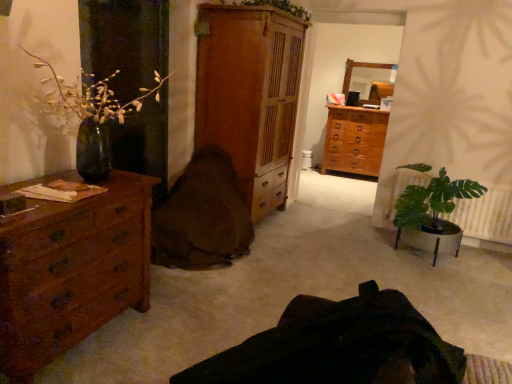
Describe the element at coordinates (354, 140) in the screenshot. Image resolution: width=512 pixels, height=384 pixels. I see `brown wooden chest of drawers at center, which appears as the 1th chest of drawers when viewed from the back` at that location.

Measure the distance between point (224, 91) and camera.

Point (224, 91) and camera are 11.75 feet apart.

Find the location of a particular element. green glossy vase at left, marked as the 1th houseplant in a left-to-right arrangement is located at coordinates [93, 96].

Image resolution: width=512 pixels, height=384 pixels. Describe the element at coordinates (72, 271) in the screenshot. I see `brown wood chest of drawers at left, the first chest of drawers when ordered from left to right` at that location.

The height and width of the screenshot is (384, 512). Describe the element at coordinates (202, 216) in the screenshot. I see `brown fabric swivel chair at center, placed as the first swivel chair when sorted from back to front` at that location.

The height and width of the screenshot is (384, 512). What do you see at coordinates (360, 67) in the screenshot?
I see `wooden frame mirror at upper center` at bounding box center [360, 67].

Locate an element on the screen. This screenshot has height=384, width=512. green leafy plant at lower right, placed as the second houseplant when sorted from front to back is located at coordinates (433, 213).

Which object is further away from the camera, green leafy plant at lower right, marked as the first houseplant in a back-to-front arrangement, or brown wood chest of drawers at left, the first chest of drawers when ordered from left to right?

green leafy plant at lower right, marked as the first houseplant in a back-to-front arrangement, is further away from the camera.

Considering the sizes of green leafy plant at lower right, which is counted as the 1th houseplant, starting from the right, and brown wood chest of drawers at left, the first chest of drawers when ordered from left to right, in the image, is green leafy plant at lower right, which is counted as the 1th houseplant, starting from the right, taller or shorter than brown wood chest of drawers at left, the first chest of drawers when ordered from left to right,?

green leafy plant at lower right, which is counted as the 1th houseplant, starting from the right, is shorter than brown wood chest of drawers at left, the first chest of drawers when ordered from left to right.

Is brown wood chest of drawers at left, the 3th chest of drawers in the back-to-front sequence, at the back of green leafy plant at lower right, placed as the second houseplant when sorted from front to back?

green leafy plant at lower right, placed as the second houseplant when sorted from front to back, is not turned away from brown wood chest of drawers at left, the 3th chest of drawers in the back-to-front sequence.

Consider the image. Would you say brown wooden chest of drawers at center, positioned as the 3th chest of drawers in left-to-right order, is outside wooden frame mirror at upper center?

Absolutely, brown wooden chest of drawers at center, positioned as the 3th chest of drawers in left-to-right order, is external to wooden frame mirror at upper center.

From the picture: Does brown wooden chest of drawers at center, positioned as the 3th chest of drawers in left-to-right order, lie behind wooden frame mirror at upper center?

No, it is not.

Is green glossy vase at left, placed as the 2th houseplant when sorted from right to left, not inside wooden cabinet at center, the 2th chest of drawers viewed from the back?

green glossy vase at left, placed as the 2th houseplant when sorted from right to left, is positioned outside wooden cabinet at center, the 2th chest of drawers viewed from the back.

Does point (60, 94) come behind point (287, 141)?

No, (60, 94) is closer to viewer.

Is green glossy vase at left, placed as the 2th houseplant when sorted from right to left, bigger than wooden cabinet at center, which is counted as the 2th chest of drawers, starting from the front?

Result: No.

From their relative heights in the image, would you say green glossy vase at left, placed as the 2th houseplant when sorted from right to left, is taller or shorter than wooden cabinet at center, the 2th chest of drawers viewed from the back?

In the image, green glossy vase at left, placed as the 2th houseplant when sorted from right to left, appears to be shorter than wooden cabinet at center, the 2th chest of drawers viewed from the back.

Considering the relative positions of brown fabric swivel chair at center, placed as the first swivel chair when sorted from back to front, and green leafy plant at upper center in the image provided, is brown fabric swivel chair at center, placed as the first swivel chair when sorted from back to front, to the left or to the right of green leafy plant at upper center?

brown fabric swivel chair at center, placed as the first swivel chair when sorted from back to front, is positioned on green leafy plant at upper center's left side.

What's the angular difference between brown fabric swivel chair at center, placed as the first swivel chair when sorted from back to front, and green leafy plant at upper center's facing directions?

There is a 91.5-degree angle between the facing directions of brown fabric swivel chair at center, placed as the first swivel chair when sorted from back to front, and green leafy plant at upper center.

In the image, is brown fabric swivel chair at center, placed as the first swivel chair when sorted from back to front, positioned in front of or behind green leafy plant at upper center?

Clearly, brown fabric swivel chair at center, placed as the first swivel chair when sorted from back to front, is in front of green leafy plant at upper center.

From the image's perspective, is brown fabric swivel chair at center, placed as the first swivel chair when sorted from back to front, positioned above or below green leafy plant at upper center?

brown fabric swivel chair at center, placed as the first swivel chair when sorted from back to front, is situated lower than green leafy plant at upper center in the image.

From the image's perspective, is green leafy plant at lower right, placed as the second houseplant when sorted from left to right, above or below wooden cabinet at center, the 2th chest of drawers viewed from the back?

green leafy plant at lower right, placed as the second houseplant when sorted from left to right, is situated lower than wooden cabinet at center, the 2th chest of drawers viewed from the back, in the image.

Is green leafy plant at lower right, placed as the second houseplant when sorted from left to right, bigger or smaller than wooden cabinet at center, the 2th chest of drawers viewed from the back?

green leafy plant at lower right, placed as the second houseplant when sorted from left to right, is smaller than wooden cabinet at center, the 2th chest of drawers viewed from the back.

Does point (472, 180) appear closer or farther from the camera than point (204, 125)?

Point (472, 180) is positioned farther from the camera compared to point (204, 125).

From the image's perspective, relative to wooden frame mirror at upper center, is green leafy plant at lower right, marked as the first houseplant in a back-to-front arrangement, above or below?

green leafy plant at lower right, marked as the first houseplant in a back-to-front arrangement, is below wooden frame mirror at upper center.

Considering the relative sizes of green leafy plant at lower right, which is counted as the 1th houseplant, starting from the right, and wooden frame mirror at upper center in the image provided, is green leafy plant at lower right, which is counted as the 1th houseplant, starting from the right, thinner than wooden frame mirror at upper center?

In fact, green leafy plant at lower right, which is counted as the 1th houseplant, starting from the right, might be wider than wooden frame mirror at upper center.

This screenshot has height=384, width=512. In order to click on mirror on the left of green leafy plant at lower right, which is counted as the 1th houseplant, starting from the right in this screenshot , I will do `click(360, 67)`.

Does dark brown leather swivel chair at center, placed as the 2th swivel chair when sorted from back to front, have a lesser width compared to brown wood chest of drawers at left, the first chest of drawers when ordered from left to right?

No, dark brown leather swivel chair at center, placed as the 2th swivel chair when sorted from back to front, is not thinner than brown wood chest of drawers at left, the first chest of drawers when ordered from left to right.

Would you say dark brown leather swivel chair at center, the first swivel chair when ordered from front to back, is to the left or to the right of brown wood chest of drawers at left, which is the first chest of drawers in front-to-back order, in the picture?

dark brown leather swivel chair at center, the first swivel chair when ordered from front to back, is to the right of brown wood chest of drawers at left, which is the first chest of drawers in front-to-back order.

At what (x,y) coordinates should I click in order to perform the action: click on the 2nd swivel chair located above the brown wood chest of drawers at left, the 3th chest of drawers in the back-to-front sequence (from a real-world perspective). Please return your answer as a coordinate pair (x, y). The height and width of the screenshot is (384, 512). Looking at the image, I should click on (348, 348).

Could you tell me if dark brown leather swivel chair at center, placed as the 2th swivel chair when sorted from back to front, is facing brown wood chest of drawers at left, the third chest of drawers positioned from the right?

Yes, dark brown leather swivel chair at center, placed as the 2th swivel chair when sorted from back to front, is oriented towards brown wood chest of drawers at left, the third chest of drawers positioned from the right.

Image resolution: width=512 pixels, height=384 pixels. I want to click on the 2nd houseplant behind the brown wood chest of drawers at left, which is the first chest of drawers in front-to-back order, so click(433, 213).

Locate an element on the screen. Image resolution: width=512 pixels, height=384 pixels. mirror above the brown wooden chest of drawers at center, which is the third chest of drawers from front to back (from a real-world perspective) is located at coordinates (360, 67).

Which object lies further to the anchor point wooden cabinet at center, which ranks as the second chest of drawers in right-to-left order, brown fabric swivel chair at center, placed as the first swivel chair when sorted from back to front, or brown wood chest of drawers at left, the third chest of drawers positioned from the right?

brown wood chest of drawers at left, the third chest of drawers positioned from the right, is positioned further to the anchor wooden cabinet at center, which ranks as the second chest of drawers in right-to-left order.

When comparing their distances from brown fabric swivel chair at center, which appears as the second swivel chair when viewed from the front, does brown wooden chest of drawers at center, arranged as the 1th chest of drawers when viewed from the right, or wooden frame mirror at upper center seem further?

Among the two, wooden frame mirror at upper center is located further to brown fabric swivel chair at center, which appears as the second swivel chair when viewed from the front.

Based on their spatial positions, is dark brown leather swivel chair at center, the first swivel chair when ordered from front to back, or brown fabric swivel chair at center, placed as the first swivel chair when sorted from back to front, further from brown wooden chest of drawers at center, arranged as the 1th chest of drawers when viewed from the right?

dark brown leather swivel chair at center, the first swivel chair when ordered from front to back, is further to brown wooden chest of drawers at center, arranged as the 1th chest of drawers when viewed from the right.

Based on the photo, considering their positions, is green glossy vase at left, placed as the 2th houseplant when sorted from right to left, positioned further to brown wooden chest of drawers at center, which is the third chest of drawers from front to back, than brown wood chest of drawers at left, the 3th chest of drawers in the back-to-front sequence?

brown wood chest of drawers at left, the 3th chest of drawers in the back-to-front sequence, is further to brown wooden chest of drawers at center, which is the third chest of drawers from front to back.

Looking at the image, which one is located closer to wooden frame mirror at upper center, brown wooden chest of drawers at center, which is the third chest of drawers from front to back, or brown wood chest of drawers at left, the 3th chest of drawers in the back-to-front sequence?

Among the two, brown wooden chest of drawers at center, which is the third chest of drawers from front to back, is located nearer to wooden frame mirror at upper center.

Looking at the image, which one is located closer to brown fabric swivel chair at center, placed as the first swivel chair when sorted from back to front, dark brown leather swivel chair at center, placed as the 2th swivel chair when sorted from back to front, or green glossy vase at left, placed as the 2th houseplant when sorted from right to left?

green glossy vase at left, placed as the 2th houseplant when sorted from right to left, lies closer to brown fabric swivel chair at center, placed as the first swivel chair when sorted from back to front, than the other object.

From the picture: Which object lies nearer to the anchor point brown wooden chest of drawers at center, positioned as the 3th chest of drawers in left-to-right order, green leafy plant at upper center or wooden frame mirror at upper center?

wooden frame mirror at upper center lies closer to brown wooden chest of drawers at center, positioned as the 3th chest of drawers in left-to-right order, than the other object.

Based on the photo, estimate the real-world distances between objects in this image. Which object is further from wooden cabinet at center, which is counted as the 2th chest of drawers, starting from the front, dark brown leather swivel chair at center, placed as the 2th swivel chair when sorted from back to front, or brown wooden chest of drawers at center, positioned as the 3th chest of drawers in left-to-right order?

Among the two, dark brown leather swivel chair at center, placed as the 2th swivel chair when sorted from back to front, is located further to wooden cabinet at center, which is counted as the 2th chest of drawers, starting from the front.

Locate an element on the screen. plant between brown fabric swivel chair at center, placed as the first swivel chair when sorted from back to front, and brown wooden chest of drawers at center, which appears as the 1th chest of drawers when viewed from the back, in the front-back direction is located at coordinates (274, 6).

At what (x,y) coordinates should I click in order to perform the action: click on plant between brown fabric swivel chair at center, which appears as the second swivel chair when viewed from the front, and wooden frame mirror at upper center in the front-back direction. Please return your answer as a coordinate pair (x, y). Looking at the image, I should click on (274, 6).

This screenshot has height=384, width=512. What are the coordinates of `houseplant positioned between green leafy plant at upper center and brown wooden chest of drawers at center, positioned as the 3th chest of drawers in left-to-right order, from near to far` in the screenshot? It's located at (433, 213).

You are a GUI agent. You are given a task and a screenshot of the screen. Output one action in this format:
    pyautogui.click(x=<x>, y=<y>)
    Task: Click on the houseplant between green leafy plant at upper center and wooden frame mirror at upper center in the front-back direction
    This screenshot has height=384, width=512.
    Given the screenshot: What is the action you would take?
    pyautogui.click(x=433, y=213)